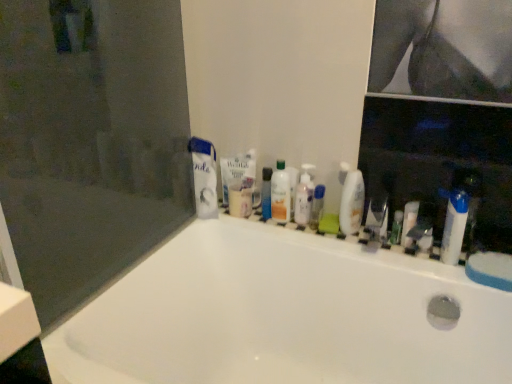
Question: Visually, is white glossy bathtub at center positioned to the left or to the right of white glossy mouthwash at center, which is the 1th mouthwash in right-to-left order?

Choices:
 (A) left
 (B) right

Answer: (A)

Question: In terms of height, does white glossy bathtub at center look taller or shorter compared to white glossy mouthwash at center, which is the 1th mouthwash in right-to-left order?

Choices:
 (A) tall
 (B) short

Answer: (A)

Question: Which is farther from the white plastic toothbrush at center, which ranks as the 5th toiletry in left-to-right order?

Choices:
 (A) white glossy bathtub at center
 (B) metallic silver razor at center, which appears as the 4th toiletry when viewed from the right
 (C) transparent plastic bottle at center, placed as the second mouthwash when sorted from right to left
 (D) translucent plastic bottles at center, the fifth toiletry positioned from the right
 (E) translucent plastic mouthwash at center, which is the first mouthwash in left-to-right order

Answer: (A)

Question: Based on their relative distances, which object is farther from the white matte toothpaste at upper left, the first toothpaste positioned from the left?

Choices:
 (A) white plastic tube at right, which is the 6th toiletry in left-to-right order
 (B) white glossy mouthwash at center, which is the 1th mouthwash in right-to-left order
 (C) white glossy bathtub at center
 (D) matte white faucet at right
 (E) blue plastic tube at center, the first toiletry in the left-to-right sequence

Answer: (A)